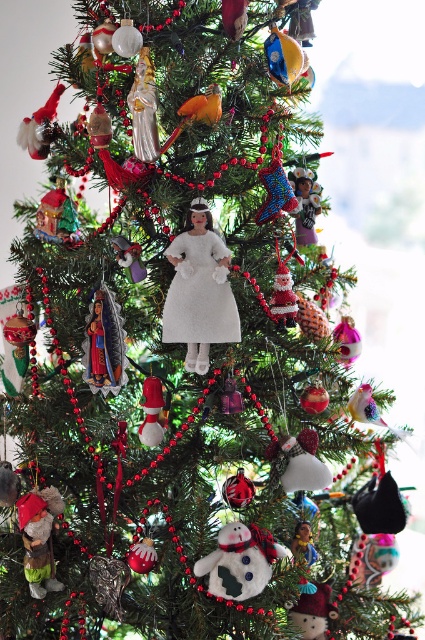
You are standing 1.5 meters away from the Christmas tree. There is a point marked at coordinates point (34, 509). Can you reach this point without moving closer to the tree?

The point (34, 509) is 1.11 meters from the camera. Since you are 1.5 meters away from the tree, you are farther than the point, so you cannot reach it without moving closer.

You are standing in front of the Christmas tree and want to reach both the shiny metallic angel at center and the satin santa at center. Which ornament will you need to stretch your arm further to reach?

The satin santa at center is farther away than the shiny metallic angel at center, so you will need to stretch your arm further to reach the satin santa at center.

You are a child trying to reach the ornaments on the Christmas tree. You can easily reach the shiny metallic angel at center but struggle to touch the white matte doll at center. Why do you think this is happening?

The white matte doll at center has a greater height compared to the shiny metallic angel at center, so it is placed higher up on the tree, making it harder for you to reach.